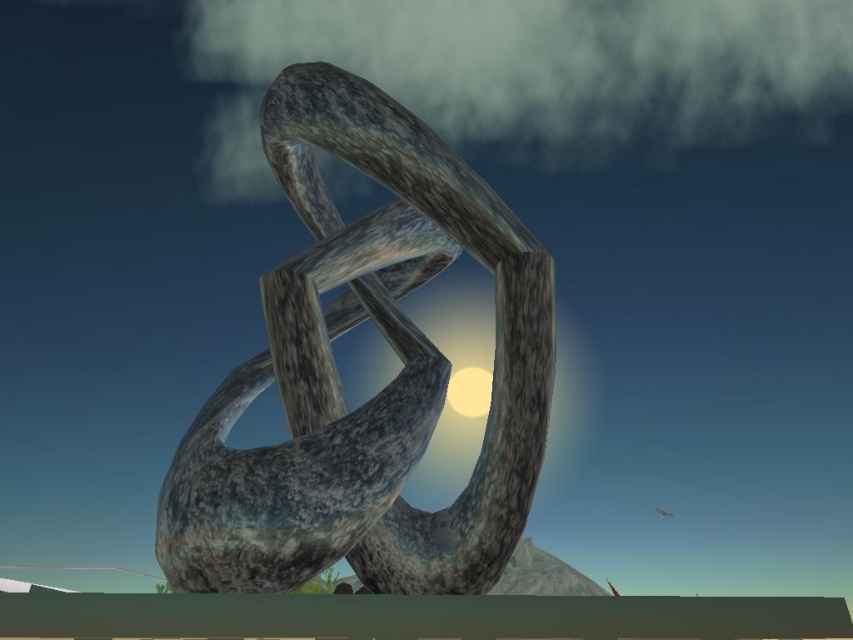
You are an artist planning to paint the sculpture located at point (381,388). Based on the scene description, what material does the sculpture appear to be made of?

The sculpture at point (381,388) appears to be made of rustic stone, as described in the scene.

You are an art student analyzing the sculpture and the sphere in the image. Which object is taller between the rustic stone sculpture at center and the matte gray sphere at center?

The rustic stone sculpture at center is taller than the matte gray sphere at center.